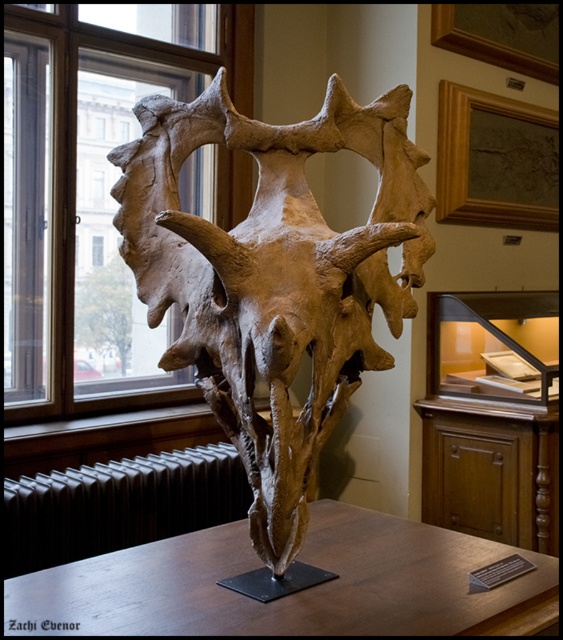
Question: Is brown bone skull at center bigger than brown wooden table at center?

Choices:
 (A) no
 (B) yes

Answer: (B)

Question: Is clear glass window at upper left to the left of brown wooden table at center from the viewer's perspective?

Choices:
 (A) yes
 (B) no

Answer: (A)

Question: Estimate the real-world distances between objects in this image. Which object is closer to the black metal radiator at lower left?

Choices:
 (A) clear glass window at upper left
 (B) brown wooden table at center

Answer: (A)

Question: Which of these objects is positioned farthest from the black metal radiator at lower left?

Choices:
 (A) brown bone skull at center
 (B) clear glass window at upper left

Answer: (A)

Question: Is brown bone skull at center behind brown wooden table at center?

Choices:
 (A) yes
 (B) no

Answer: (B)

Question: Which point is closer to the camera?

Choices:
 (A) (229, 112)
 (B) (245, 509)

Answer: (A)